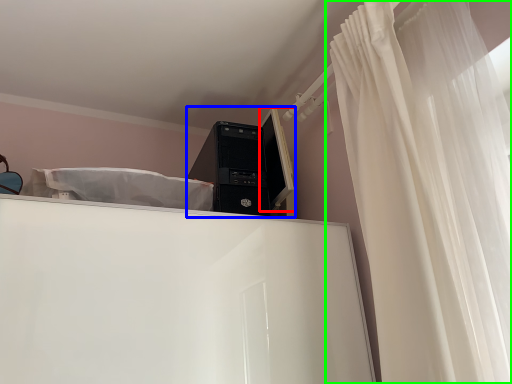
Question: Estimate the real-world distances between objects in this image. Which object is closer to computer monitor (highlighted by a red box), desktop computer (highlighted by a blue box) or curtain (highlighted by a green box)?

Choices:
 (A) desktop computer
 (B) curtain

Answer: (A)